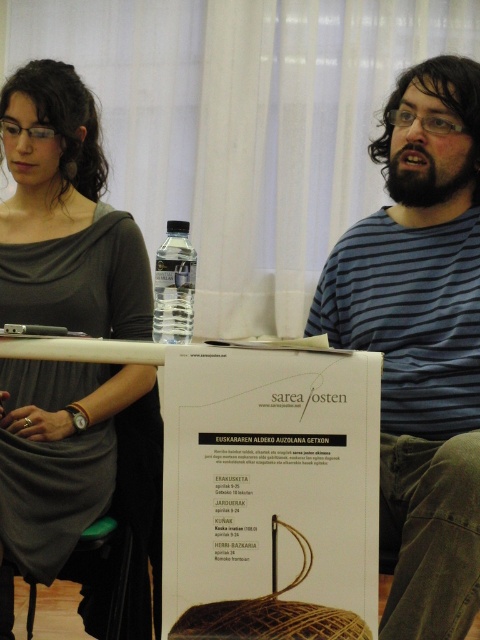
Consider the image. You are an interior designer assessing the layout of this room. The white paper poster at center and the matte gray dress at upper left are both on the table. Which object is shorter in height?

The white paper poster at center is shorter in height than the matte gray dress at upper left because it is not as tall as the dress.

You are observing a scene where two people are sitting at a table. You see a blue striped shirt at center and a matte gray dress at upper left. Which clothing item is located to the right of the other?

The blue striped shirt at center is positioned on the right side of matte gray dress at upper left.